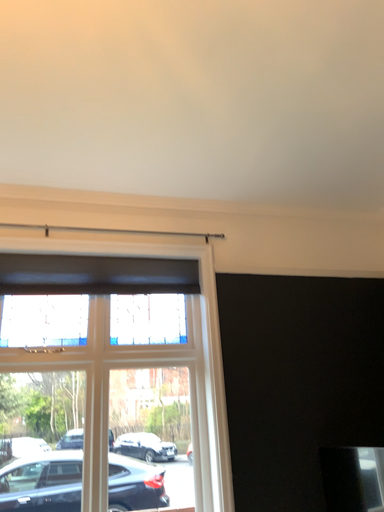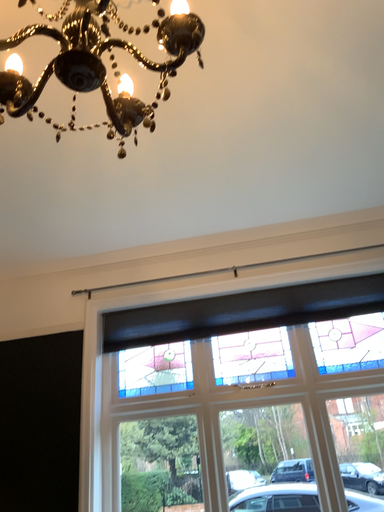
Question: How did the camera likely rotate when shooting the video?

Choices:
 (A) rotated right
 (B) rotated left

Answer: (B)